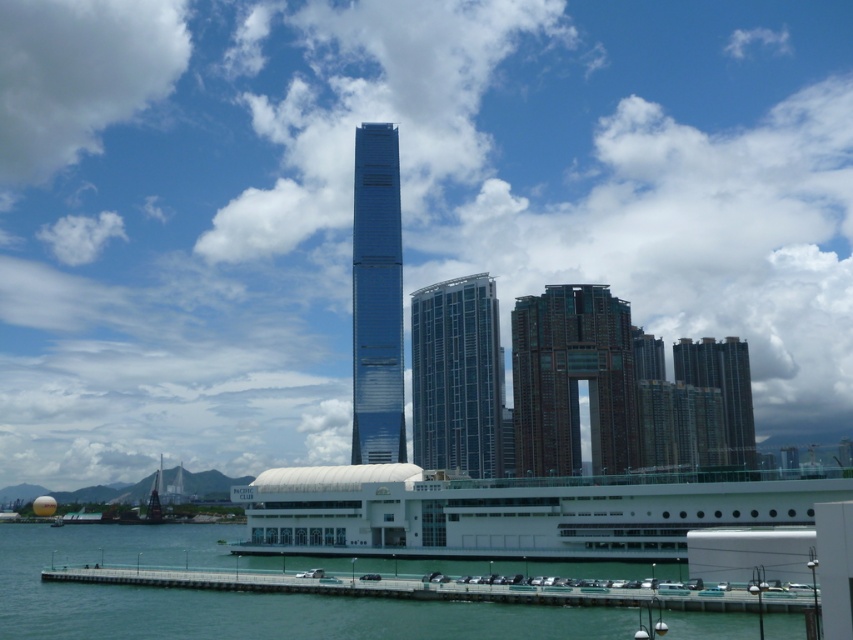
Is white fluffy cloud at upper left positioned at the back of glassy blue skyscraper at center?

That is True.

Is point (12, 173) farther from viewer compared to point (433, 289)?

Yes, point (12, 173) is farther from viewer.

You are a GUI agent. You are given a task and a screenshot of the screen. Output one action in this format:
    pyautogui.click(x=<x>, y=<y>)
    Task: Click on the white fluffy cloud at upper left
    The image size is (853, 640).
    Given the screenshot: What is the action you would take?
    pyautogui.click(x=79, y=76)

Who is lower down, clear water at lower left or brown brick building at center?

clear water at lower left is below.

Does clear water at lower left appear on the left side of brown brick building at center?

Indeed, clear water at lower left is positioned on the left side of brown brick building at center.

This screenshot has width=853, height=640. Identify the location of clear water at lower left. (236, 596).

Is glassy blue skyscraper at center smaller than glossy glass tower at center?

Correct, glassy blue skyscraper at center occupies less space than glossy glass tower at center.

Does glassy blue skyscraper at center appear on the right side of glossy glass tower at center?

Yes, glassy blue skyscraper at center is to the right of glossy glass tower at center.

Where is `glassy blue skyscraper at center`? This screenshot has height=640, width=853. glassy blue skyscraper at center is located at coordinates (457, 378).